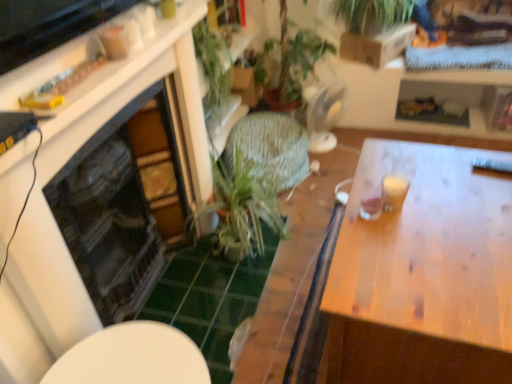
Question: From the image's perspective, is wooden table at right positioned above or below green leafy plant at center?

Choices:
 (A) below
 (B) above

Answer: (A)

Question: Do you think wooden table at right is within green leafy plant at center, or outside of it?

Choices:
 (A) inside
 (B) outside

Answer: (B)

Question: Based on their relative distances, which object is nearer to the green leafy plant at upper center?

Choices:
 (A) white glossy table at lower center
 (B) wooden table at right
 (C) green leafy plant at center

Answer: (C)

Question: Based on their relative distances, which object is farther from the green leafy plant at center?

Choices:
 (A) white glossy table at lower center
 (B) green leafy plant at upper center
 (C) wooden table at right

Answer: (B)